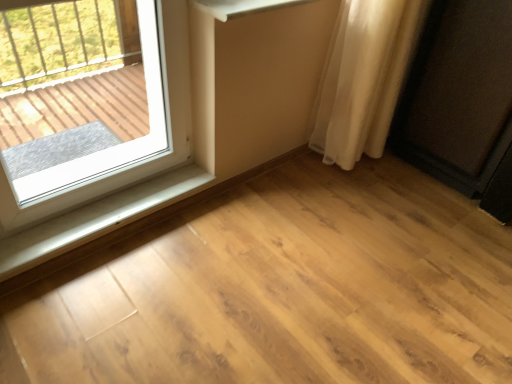
This screenshot has height=384, width=512. Find the location of `free space in front of white sheer curtain at right`. free space in front of white sheer curtain at right is located at coordinates click(360, 203).